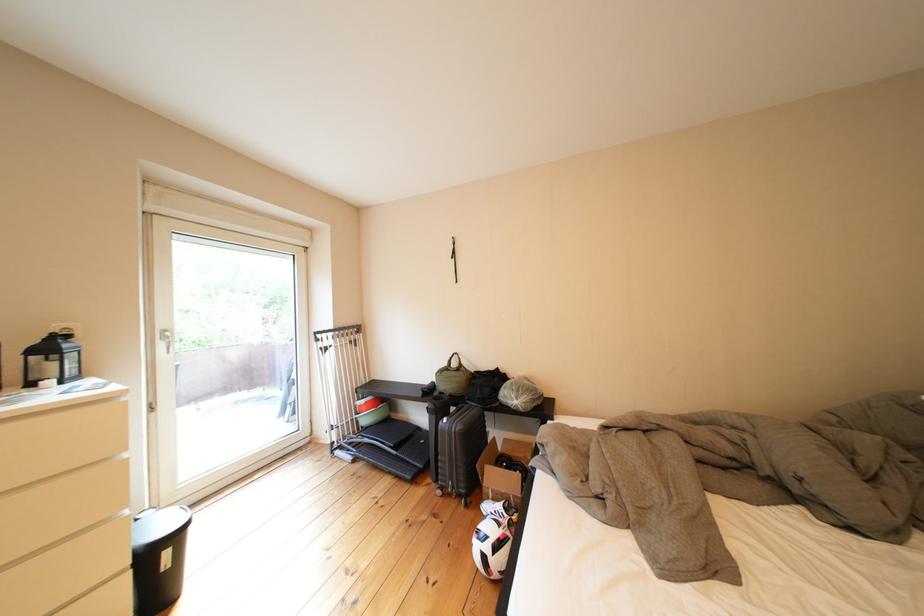
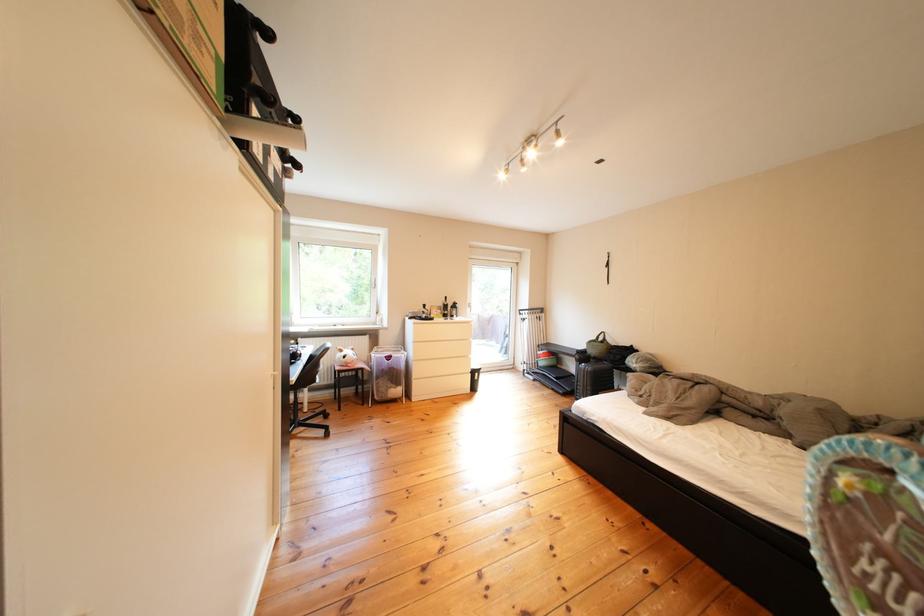
The point at (415, 419) is marked in the first image. Where is the corresponding point in the second image?

(578, 371)